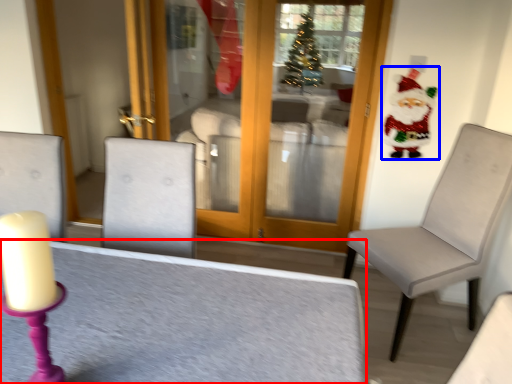
Question: Which point is further to the camera, table (highlighted by a red box) or santa claus (highlighted by a blue box)?

Choices:
 (A) table
 (B) santa claus

Answer: (B)